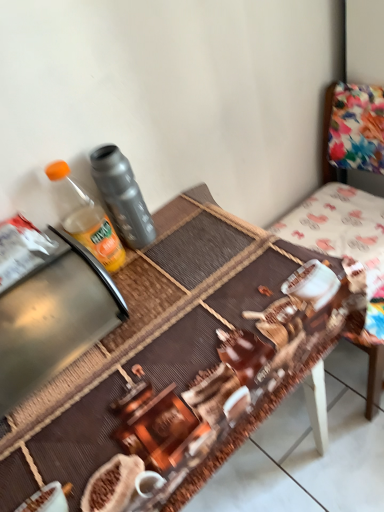
Find the location of a particular element. free point above metallic stainless steel appliance at left (from a real-world perspective) is located at coordinates (40, 266).